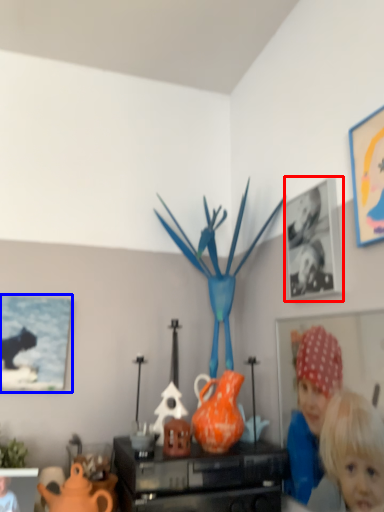
Question: Among these objects, which one is nearest to the camera, picture frame (highlighted by a red box) or picture frame (highlighted by a blue box)?

Choices:
 (A) picture frame
 (B) picture frame

Answer: (A)